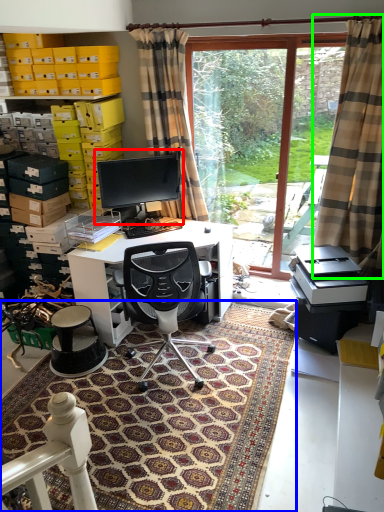
Question: Which is farther away from computer monitor (highlighted by a red box)? mat (highlighted by a blue box) or curtain (highlighted by a green box)?

Choices:
 (A) mat
 (B) curtain

Answer: (A)